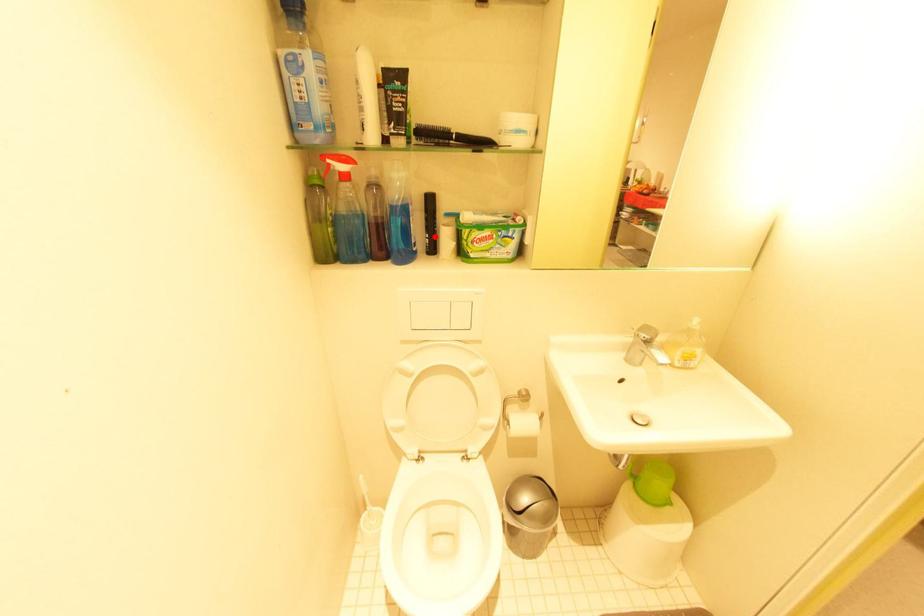
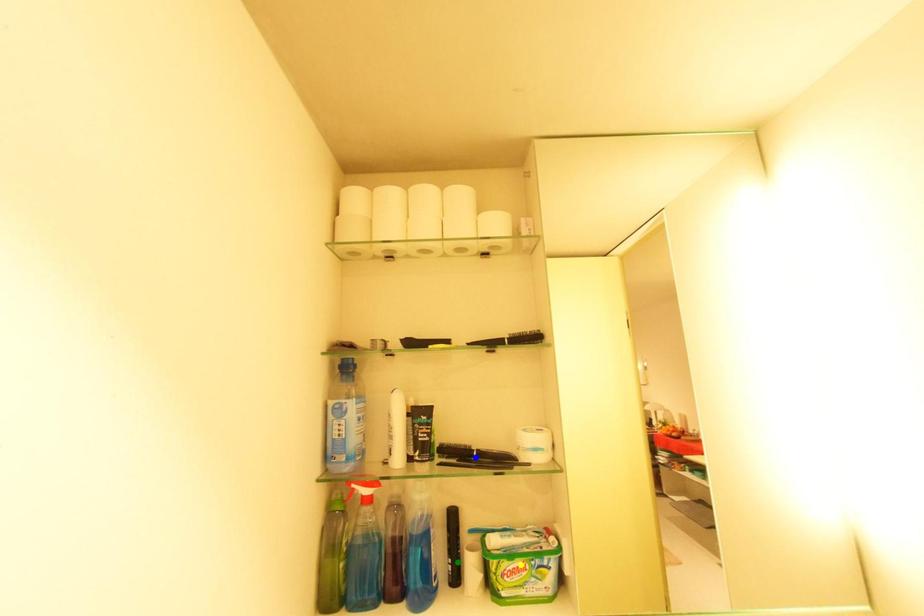
Question: I am providing you with two images of the same scene from different viewpoints. A red point is marked on the first image. You are given multiple points on the second image. Can you choose the point in image 2 that corresponds to the point in image 1?

Choices:
 (A) blue point
 (B) yellow point
 (C) green point

Answer: (C)